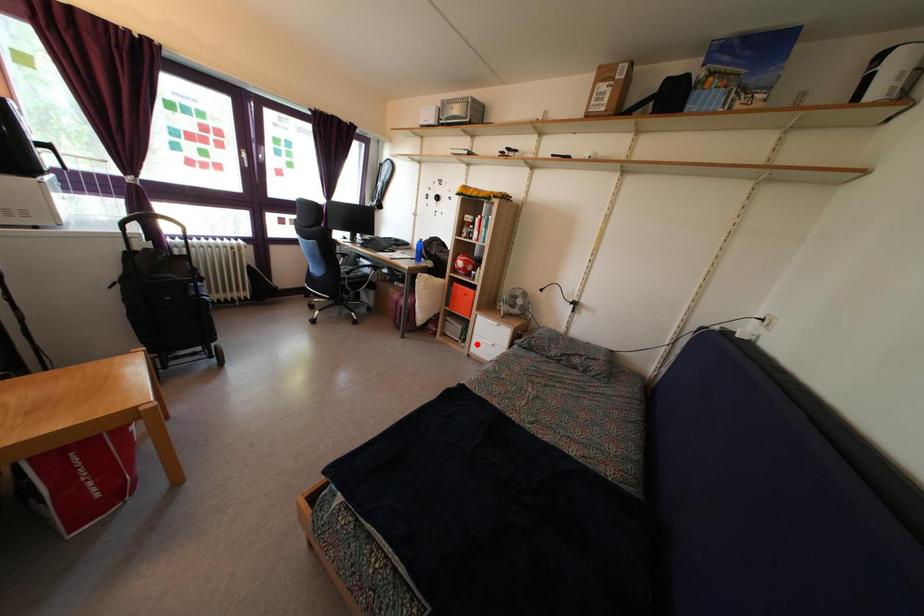
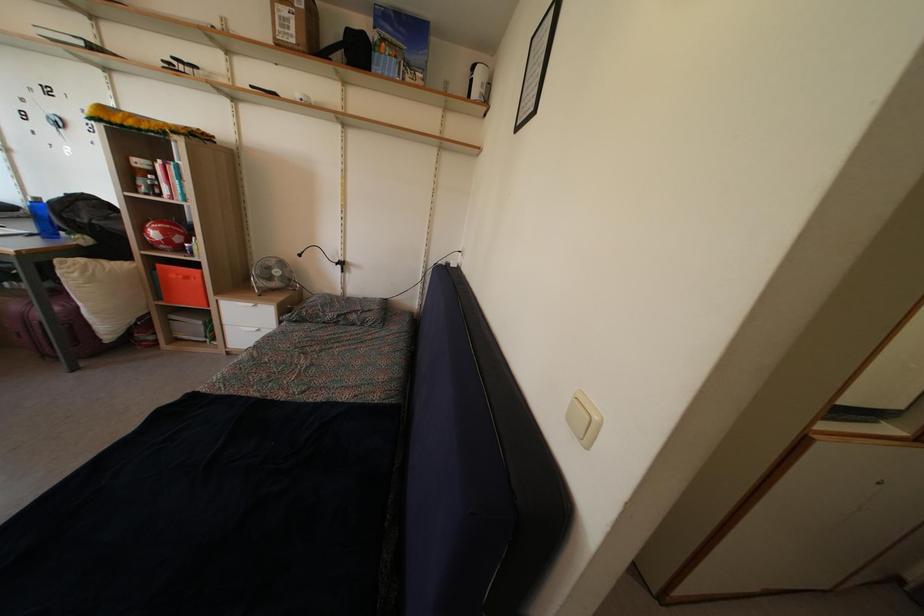
The point at the highlighted location is marked in the first image. Where is the corresponding point in the second image?

(228, 336)